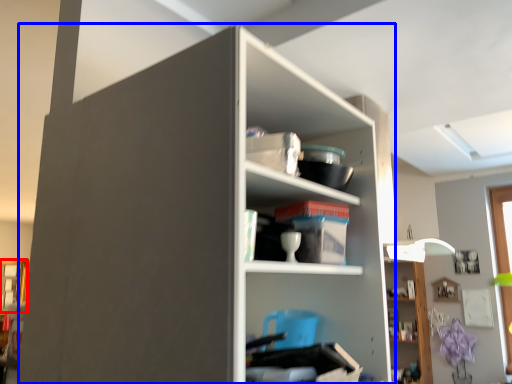
Question: Among these objects, which one is nearest to the camera, window (highlighted by a red box) or shelf (highlighted by a blue box)?

Choices:
 (A) window
 (B) shelf

Answer: (B)